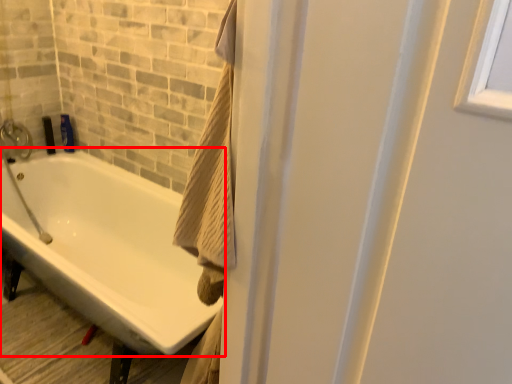
Question: From the image's perspective, what is the correct spatial positioning of bathtub (annotated by the red box) in reference to toiletry?

Choices:
 (A) above
 (B) below

Answer: (B)